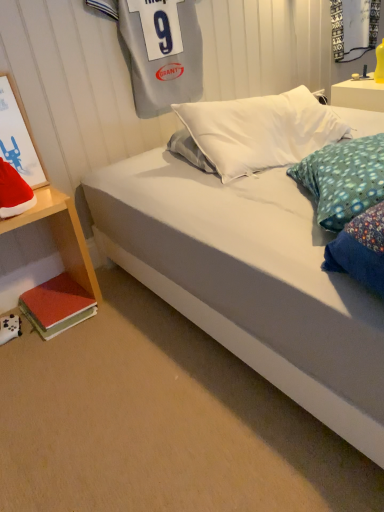
The image size is (384, 512). I want to click on vacant space underneath red velvet santa hat at left (from a real-world perspective), so 21,206.